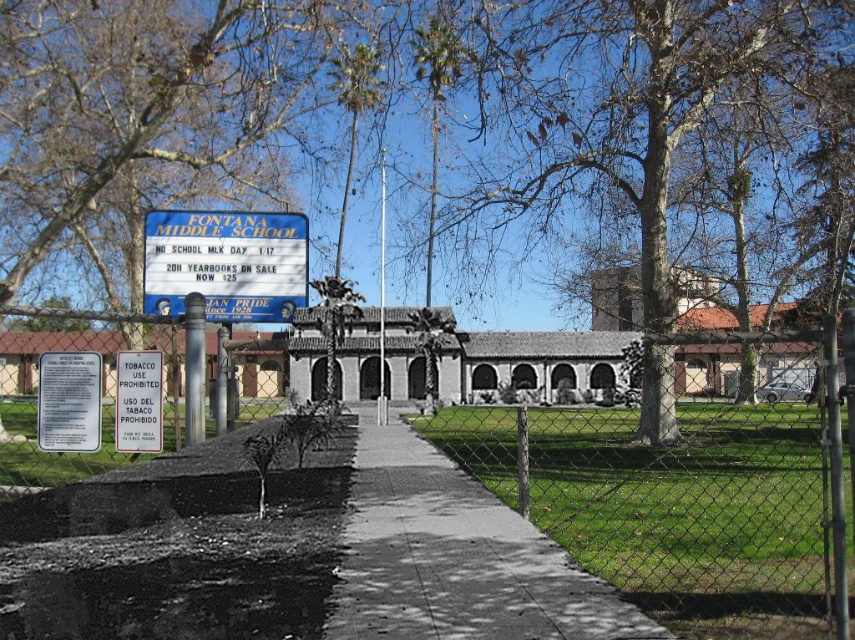
Looking at this image, is green leafy tree at center in front of white paper sign at center?

No, green leafy tree at center is behind white paper sign at center.

Who is positioned more to the left, green leafy tree at center or white paper sign at center?

white paper sign at center

Where is `green leafy tree at center`? green leafy tree at center is located at coordinates (435, 173).

Who is more distant from viewer, [534,218] or [684,566]?

Point [534,218]

Is bare wood tree at upper center wider than metal chain-link fence at center?

Yes.

This screenshot has height=640, width=855. What are the coordinates of `bare wood tree at upper center` in the screenshot? It's located at (671, 125).

This screenshot has height=640, width=855. Find the location of `bare wood tree at upper center`. bare wood tree at upper center is located at coordinates (671, 125).

Is blue plastic sign at upper center thinner than white plastic sign at lower left?

No, blue plastic sign at upper center is not thinner than white plastic sign at lower left.

Which is below, blue plastic sign at upper center or white plastic sign at lower left?

white plastic sign at lower left is lower down.

Find the location of a particular element. blue plastic sign at upper center is located at coordinates (226, 262).

In order to click on blue plastic sign at upper center in this screenshot , I will do `click(226, 262)`.